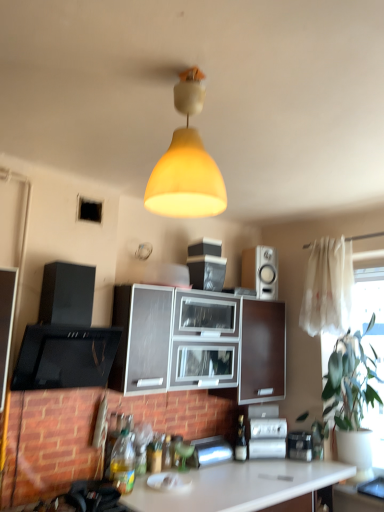
The width and height of the screenshot is (384, 512). In order to click on free space above metallic silver toaster at lower right, which is the first appliance in right-to-left order (from a real-world perspective) in this screenshot , I will do `click(305, 431)`.